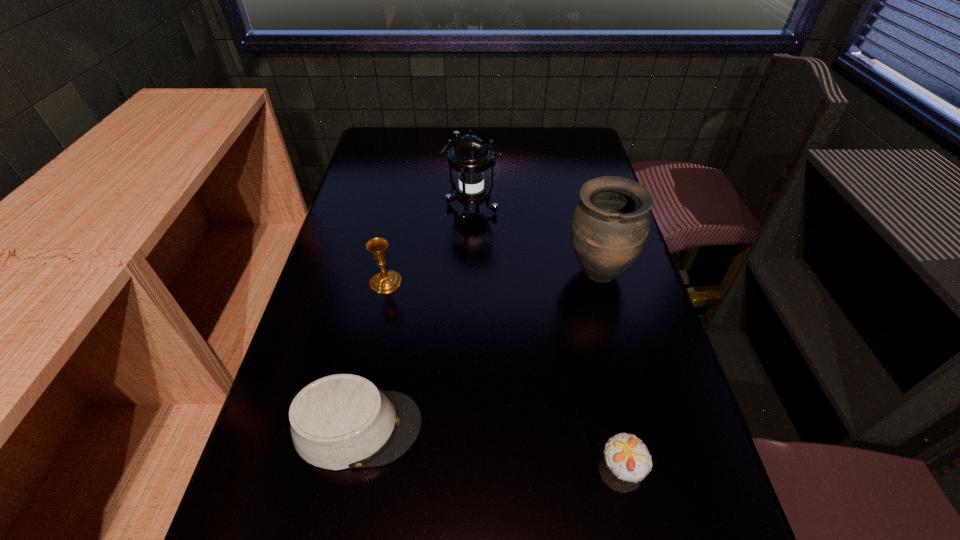
Identify the location of chalice present at the left edge. The width and height of the screenshot is (960, 540). (384, 282).

Find the location of a particular element. The height and width of the screenshot is (540, 960). hat located at the left edge is located at coordinates point(342,421).

Image resolution: width=960 pixels, height=540 pixels. In order to click on urn at the right edge in this screenshot , I will do `click(610, 225)`.

Image resolution: width=960 pixels, height=540 pixels. I want to click on cupcake present at the right edge, so click(625, 462).

The height and width of the screenshot is (540, 960). Identify the location of free space at the far edge of the desktop. (424, 138).

Where is `vacant space at the left edge`? The width and height of the screenshot is (960, 540). vacant space at the left edge is located at coordinates (263, 526).

In the image, there is a desktop. Where is `vacant space at the far right corner`? The image size is (960, 540). vacant space at the far right corner is located at coordinates (575, 150).

Locate an element on the screen. The height and width of the screenshot is (540, 960). free space between the chalice and the cupcake is located at coordinates (503, 376).

Find the location of a particular element. The height and width of the screenshot is (540, 960). vacant area that lies between the hat and the farthest object is located at coordinates (415, 318).

Find the location of a particular element. Image resolution: width=960 pixels, height=540 pixels. free space between the hat and the farthest object is located at coordinates (415, 318).